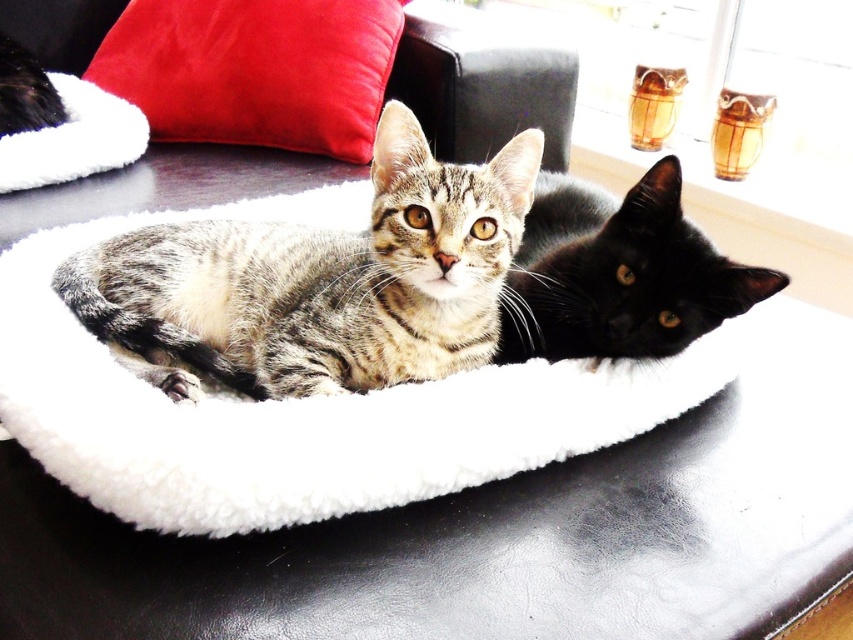
Question: Is tabby fur cat at center positioned in front of black glossy cat at center?

Choices:
 (A) yes
 (B) no

Answer: (A)

Question: Does tabby fur cat at center have a lesser width compared to black glossy cat at center?

Choices:
 (A) yes
 (B) no

Answer: (B)

Question: Which of the following is the closest to the observer?

Choices:
 (A) satin red pillow at upper left
 (B) white fluffy cat bed at center

Answer: (B)

Question: Can you confirm if white fluffy cat bed at center is bigger than tabby fur cat at center?

Choices:
 (A) yes
 (B) no

Answer: (A)

Question: Estimate the real-world distances between objects in this image. Which object is farther from the tabby fur cat at center?

Choices:
 (A) black glossy cat at center
 (B) white fluffy cat bed at center

Answer: (A)

Question: Which is farther from the tabby fur cat at center?

Choices:
 (A) black glossy cat at center
 (B) white fluffy cat bed at center
 (C) satin red pillow at upper left

Answer: (C)